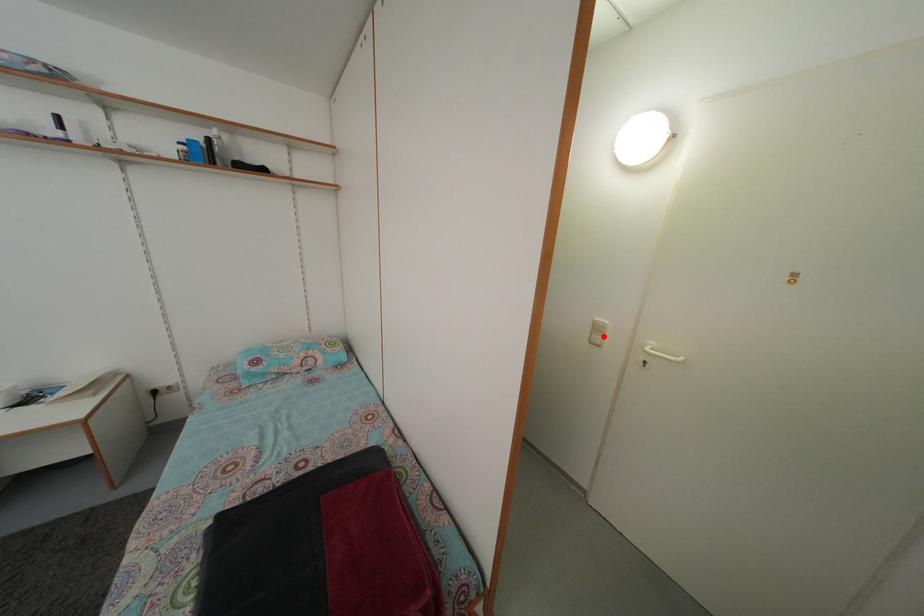
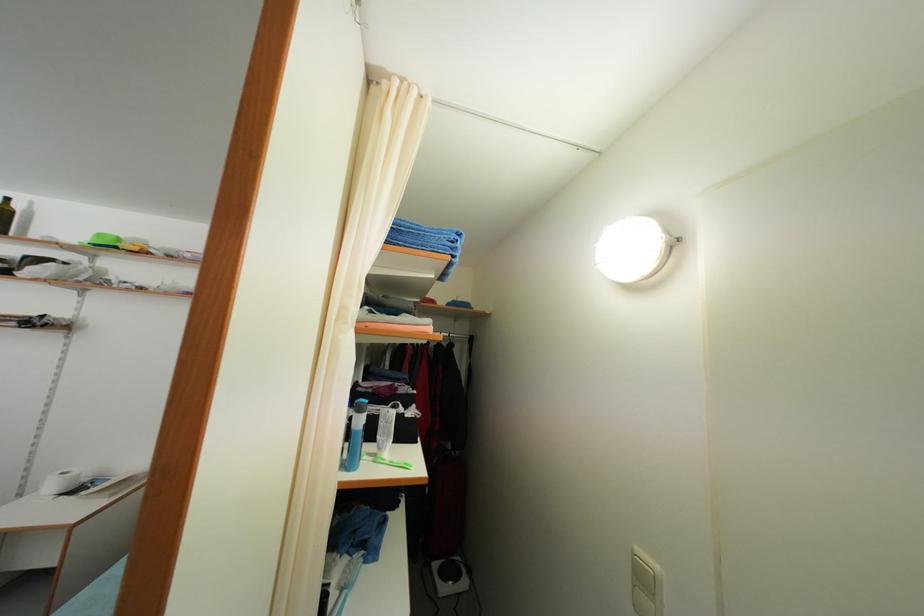
Where in the second image is the point corresponding to the highlighted location from the first image?

(649, 586)